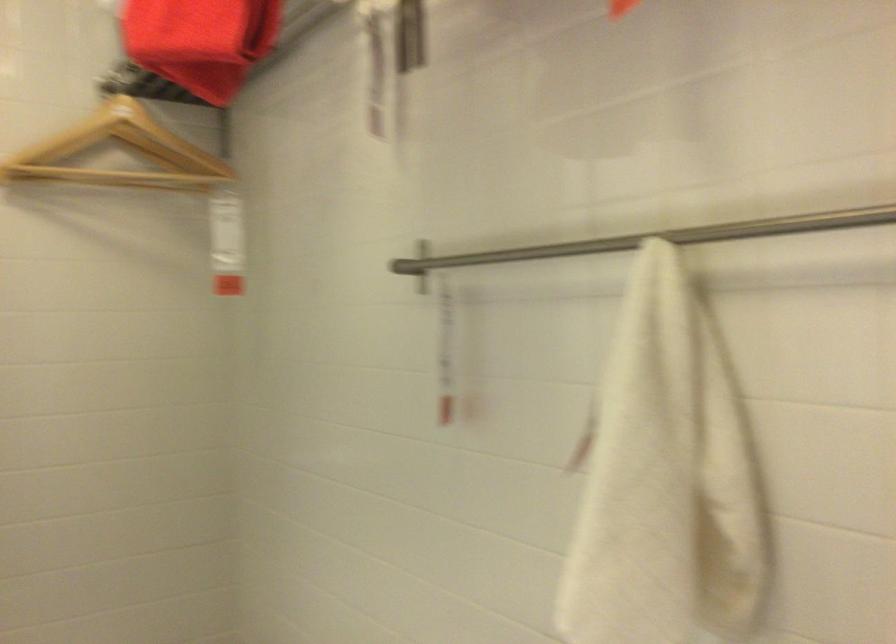
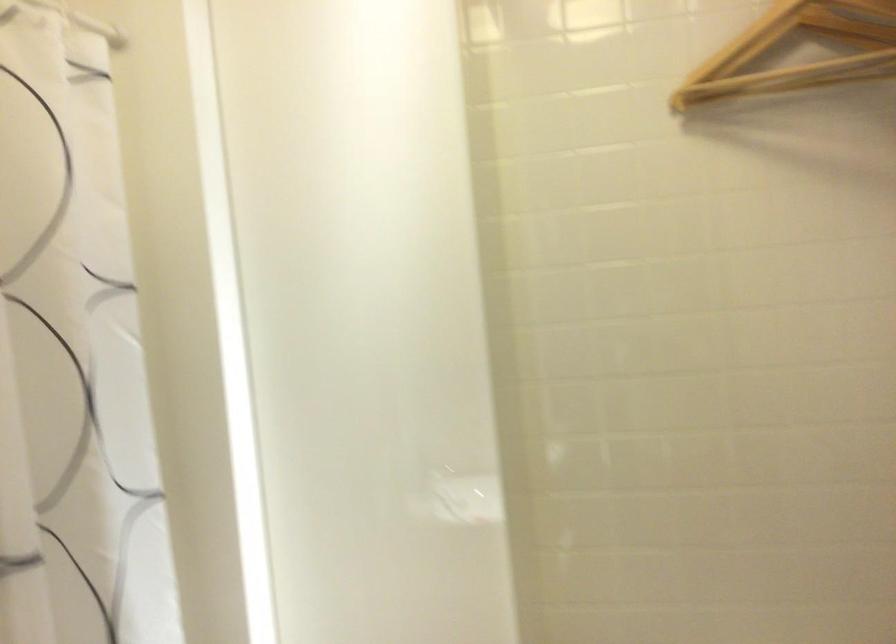
Where in the second image is the point corresponding to [109,156] from the first image?

(797, 51)